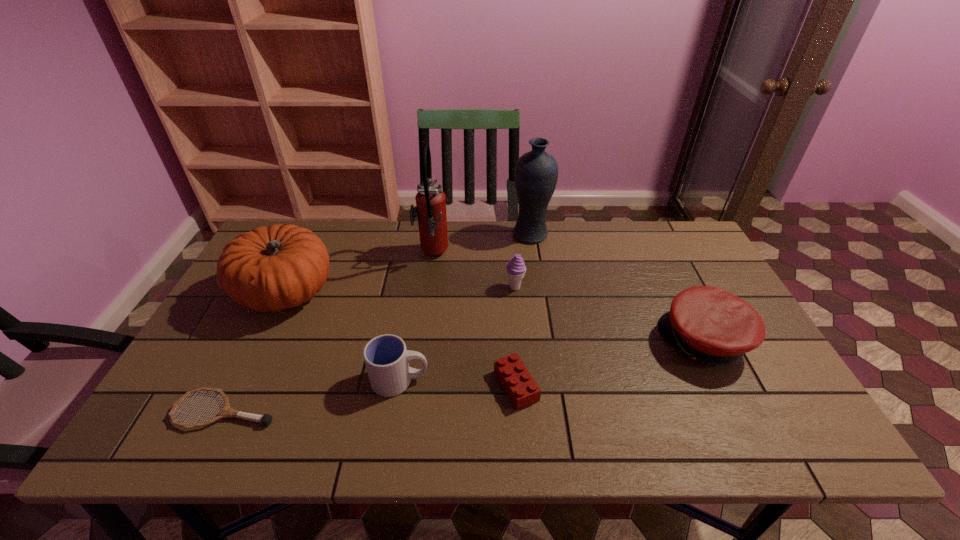
At what (x,y) coordinates should I click in order to perform the action: click on vacant space in between the second shortest object and the fire extinguisher. Please return your answer as a coordinate pair (x, y). Looking at the image, I should click on (474, 321).

I want to click on vacant region between the cup and the second shortest object, so click(x=458, y=383).

What are the coordinates of `vacant region between the third tallest object and the shortest object` in the screenshot? It's located at (256, 352).

Locate which object ranks fifth in proximity to the pumpkin. Please provide its 2D coordinates. Your answer should be formatted as a tuple, i.e. [(x, y)], where the tuple contains the x and y coordinates of a point satisfying the conditions above.

[(516, 269)]

Locate an element on the screen. The image size is (960, 540). object that is the second closest one to the vase is located at coordinates (430, 208).

Where is `vacant area in the image that satisfies the following two spatial constraints: 1. at the front of the cap where the visor is located; 2. on the front side of the shortest object`? The image size is (960, 540). vacant area in the image that satisfies the following two spatial constraints: 1. at the front of the cap where the visor is located; 2. on the front side of the shortest object is located at coordinates point(739,410).

Where is `free spot that satisfies the following two spatial constraints: 1. at the front of the rightmost object where the visor is located; 2. on the front side of the second shortest object`? free spot that satisfies the following two spatial constraints: 1. at the front of the rightmost object where the visor is located; 2. on the front side of the second shortest object is located at coordinates (727, 386).

At what (x,y) coordinates should I click in order to perform the action: click on vacant space that satisfies the following two spatial constraints: 1. at the nozzle of the fire extinguisher; 2. on the left side of the second shortest object. Please return your answer as a coordinate pair (x, y). The height and width of the screenshot is (540, 960). Looking at the image, I should click on (415, 386).

Where is `free spot that satisfies the following two spatial constraints: 1. at the front of the cap where the visor is located; 2. on the front side of the shortest object`? free spot that satisfies the following two spatial constraints: 1. at the front of the cap where the visor is located; 2. on the front side of the shortest object is located at coordinates (739, 410).